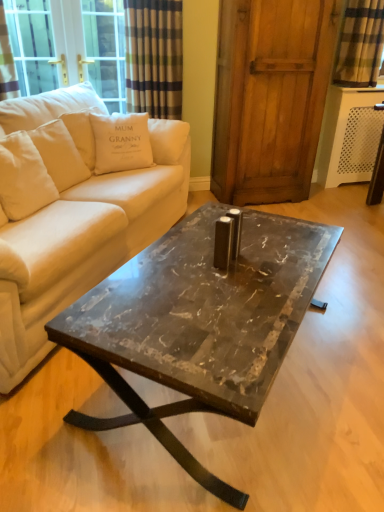
This screenshot has width=384, height=512. I want to click on free spot above marble/black at center (from a real-world perspective), so click(217, 277).